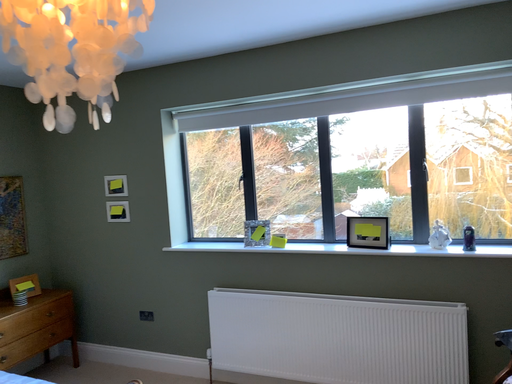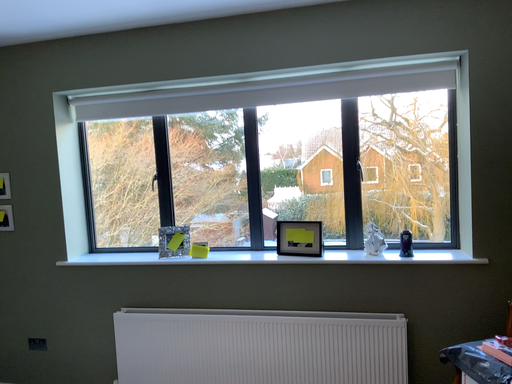
Question: Which way did the camera rotate in the video?

Choices:
 (A) rotated left
 (B) rotated right

Answer: (B)